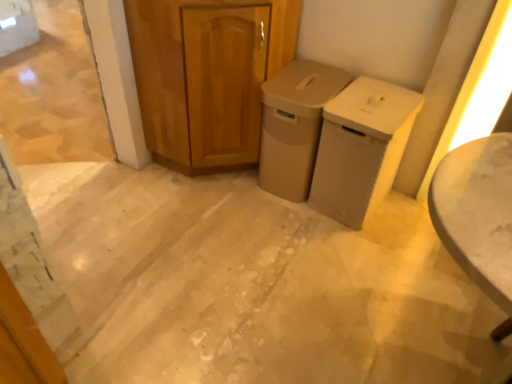
Question: Considering the positions of beige matte trash can at center, positioned as the 2th waste container in right-to-left order, and beige textured waste bin at center-right, acting as the second waste container starting from the left, in the image, is beige matte trash can at center, positioned as the 2th waste container in right-to-left order, taller or shorter than beige textured waste bin at center-right, acting as the second waste container starting from the left,?

Choices:
 (A) tall
 (B) short

Answer: (A)

Question: Considering the positions of beige matte trash can at center, positioned as the first waste container in left-to-right order, and beige textured waste bin at center-right, acting as the second waste container starting from the left, in the image, is beige matte trash can at center, positioned as the first waste container in left-to-right order, wider or thinner than beige textured waste bin at center-right, acting as the second waste container starting from the left,?

Choices:
 (A) thin
 (B) wide

Answer: (B)

Question: Which is farther from the beige textured waste bin at center-right, acting as the second waste container starting from the left?

Choices:
 (A) wooden cabinet at center
 (B) beige matte trash can at center, positioned as the first waste container in left-to-right order

Answer: (A)

Question: Considering the real-world distances, which object is farthest from the beige matte trash can at center, positioned as the 2th waste container in right-to-left order?

Choices:
 (A) beige textured waste bin at center-right, positioned as the first waste container in right-to-left order
 (B) wooden cabinet at center

Answer: (B)